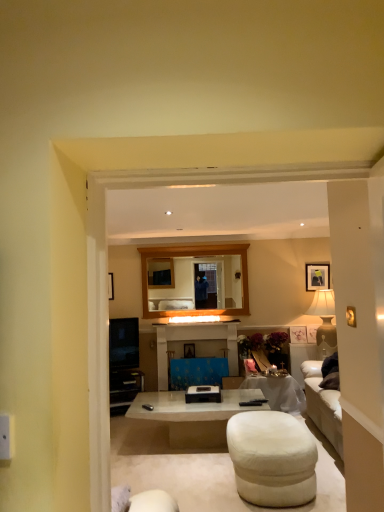
Question: Does white glossy coffee table at center appear on the left side of white fabric ottoman at lower center?

Choices:
 (A) yes
 (B) no

Answer: (A)

Question: Is white glossy coffee table at center oriented towards white fabric ottoman at lower center?

Choices:
 (A) yes
 (B) no

Answer: (A)

Question: Can you confirm if white glossy coffee table at center is thinner than white fabric ottoman at lower center?

Choices:
 (A) no
 (B) yes

Answer: (A)

Question: Would you say white glossy coffee table at center contains white fabric ottoman at lower center?

Choices:
 (A) no
 (B) yes

Answer: (A)

Question: Does white glossy coffee table at center lie behind white fabric ottoman at lower center?

Choices:
 (A) yes
 (B) no

Answer: (A)

Question: Is white fabric ottoman at lower center bigger or smaller than white glossy coffee table at center?

Choices:
 (A) big
 (B) small

Answer: (B)

Question: In the image, is white fabric ottoman at lower center positioned in front of or behind white glossy coffee table at center?

Choices:
 (A) behind
 (B) front

Answer: (B)

Question: From their relative heights in the image, would you say white fabric ottoman at lower center is taller or shorter than white glossy coffee table at center?

Choices:
 (A) short
 (B) tall

Answer: (A)

Question: Looking at their shapes, would you say white fabric ottoman at lower center is wider or thinner than white glossy coffee table at center?

Choices:
 (A) thin
 (B) wide

Answer: (A)

Question: From their relative heights in the image, would you say blue fabric-covered entertainment center at center is taller or shorter than wooden-framed mirror at center?

Choices:
 (A) tall
 (B) short

Answer: (B)

Question: From the image's perspective, is blue fabric-covered entertainment center at center positioned above or below wooden-framed mirror at center?

Choices:
 (A) above
 (B) below

Answer: (B)

Question: Is point (170, 322) closer or farther from the camera than point (223, 257)?

Choices:
 (A) closer
 (B) farther

Answer: (A)

Question: Do you think blue fabric-covered entertainment center at center is within wooden-framed mirror at center, or outside of it?

Choices:
 (A) outside
 (B) inside

Answer: (A)

Question: Is wooden-framed mirror at center spatially inside blue fabric-covered entertainment center at center, or outside of it?

Choices:
 (A) outside
 (B) inside

Answer: (A)

Question: In the image, is wooden-framed mirror at center on the left side or the right side of blue fabric-covered entertainment center at center?

Choices:
 (A) right
 (B) left

Answer: (B)